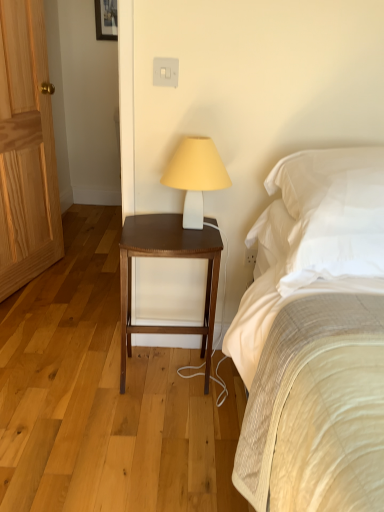
The height and width of the screenshot is (512, 384). In order to click on vacant space in front of dark wood nightstand at center in this screenshot , I will do `click(160, 432)`.